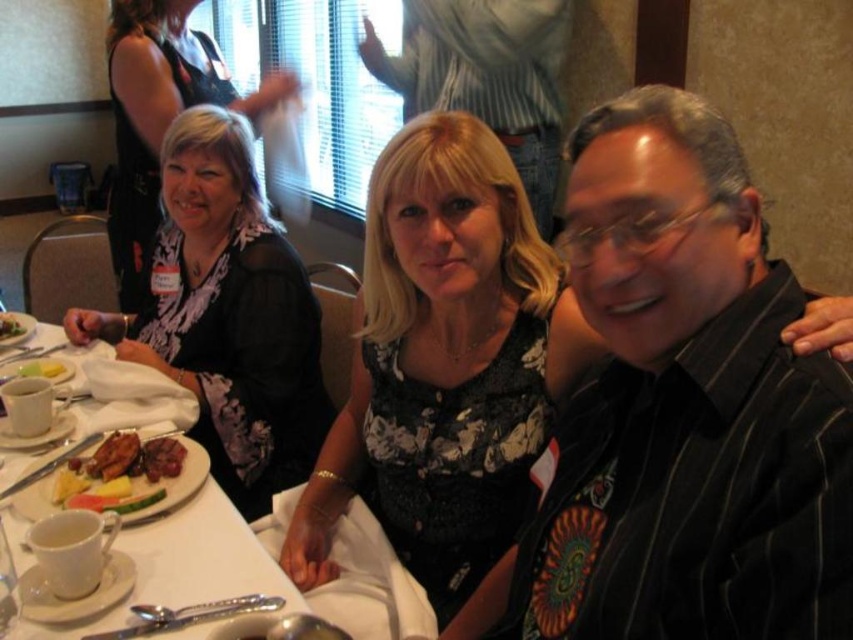
You are a photographer at a social event and need to position yourself to capture both the black striped shirt at right and the black sheer dress at left in the same frame. Based on their positions, which side of the scene should you stand to ensure both are visible?

You should stand to the left side of the scene because the black striped shirt at right is to the right of the black sheer dress at left, so positioning yourself to the left would allow both to be captured in the frame.

You are a photographer taking a group photo of the black striped shirt at right and the black sheer dress at left. Which one should you focus on if you want to capture the smaller one?

The black striped shirt at right has a smaller size compared to the black sheer dress at left, so you should focus on the black striped shirt at right to capture the smaller one.

You are sitting at the table and want to pass the white porcelain plate at left to the person wearing the black striped shirt at right. Can you directly hand it to them without moving the plate from its current position?

The black striped shirt at right is to the right of the white porcelain plate at left, so you can directly hand the white porcelain plate at left to the person wearing the black striped shirt at right without moving the plate from its current position.